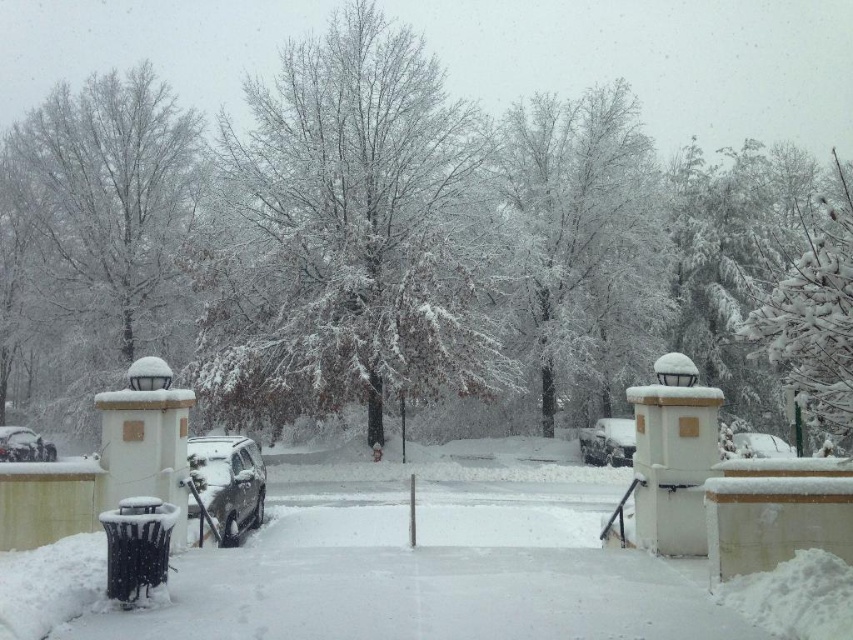
You are standing at the entrance of the driveway and want to walk to the gate. There are two points marked on the path. Which point, point 1 at coordinates point (239, 502) or point 2 at coordinates point (10, 444), is closer to you as you start walking towards the gate?

Point 1 at coordinates point (239, 502) is closer to you than point 2 at coordinates point (10, 444) because it is nearer to the viewer.

You are a delivery person trying to park your delivery van, which is 2 meters tall, in the driveway. You see the sleek silver car at center and the shiny silver car at lower left. Which car should you avoid parking behind to ensure your van can fit through the space?

You should avoid parking behind the sleek silver car at center because it is much taller than the shiny silver car at lower left, so the space behind it may not accommodate your 2 meters tall van.